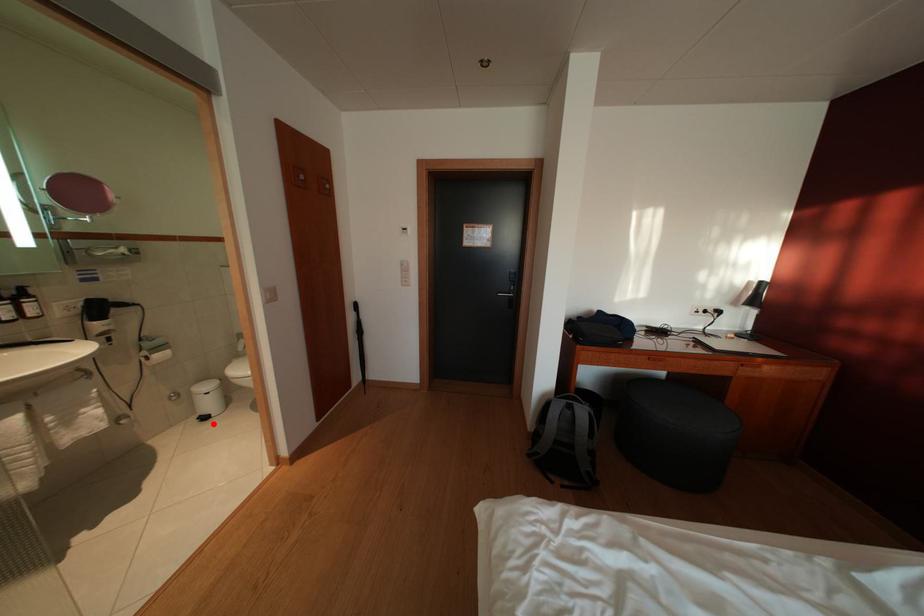
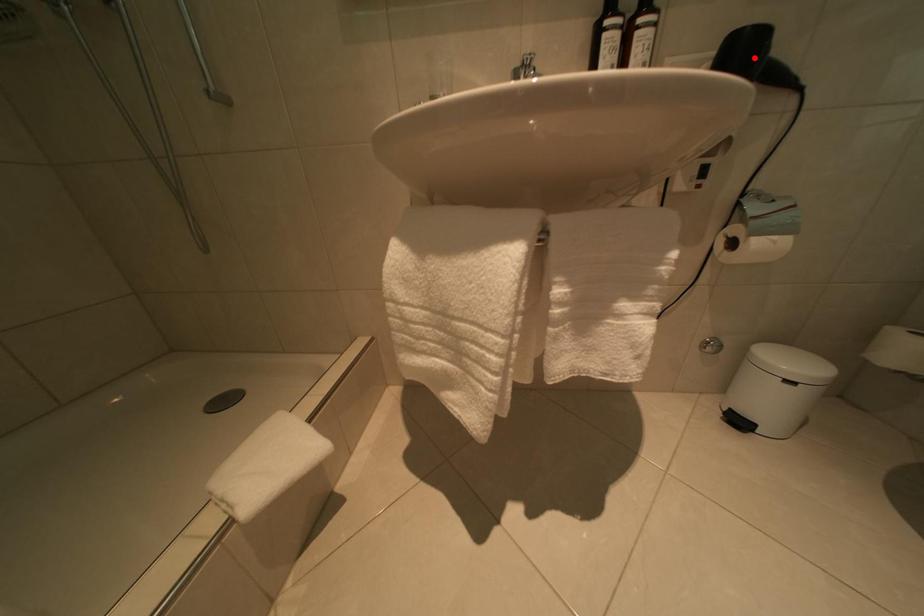
I am providing you with two images of the same scene from different viewpoints. A red point is marked on the first image and another point is marked on the second image. Does the point marked in image1 correspond to the same location as the one in image2?

No